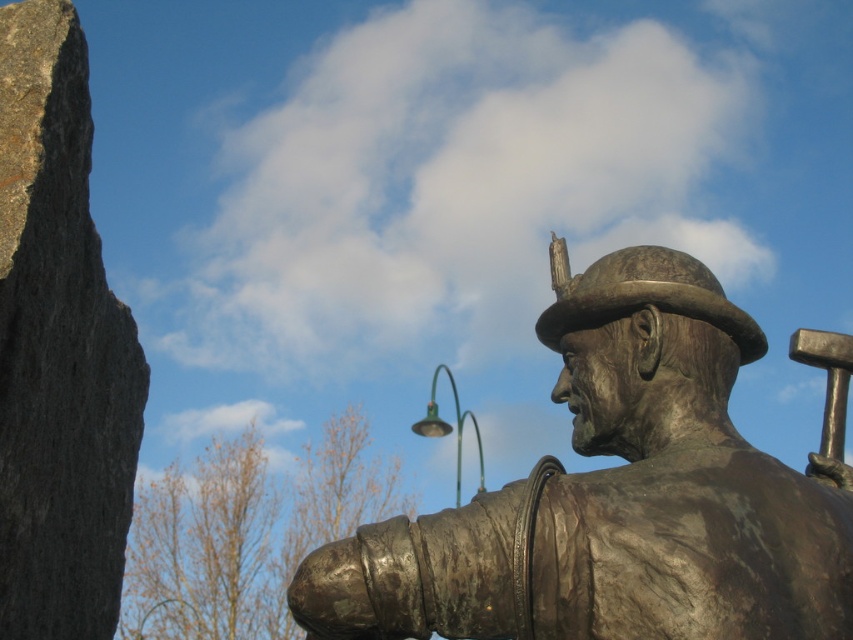
You are an art student trying to sketch the scene. You notice the bronze statue at center and the green metallic lamp post at upper center. Which object should you draw first if you want to capture the larger one first?

The green metallic lamp post at upper center is larger than the bronze statue at center, so you should draw the green metallic lamp post at upper center first.

You are a delivery person who needs to place a package between the bronze statue at center and the gray rough stone at left. The package requires a minimum of 6 feet of space to be placed safely. Can you fit the package between them?

The bronze statue at center and gray rough stone at left are 6.40 feet apart from each other. Since the required space is 6 feet, the package can be safely placed between them as the distance is sufficient.

You are standing in front of the bronze statue at center and want to take a photo of the green metallic lamp post at upper center. Since the statue is blocking your view, can you move to your left or right to get an unobstructed view of the lamp post?

The bronze statue at center is positioned over green metallic lamp post at upper center, so moving to either the left or right side of the bronze statue at center should provide an unobstructed view of the green metallic lamp post at upper center.